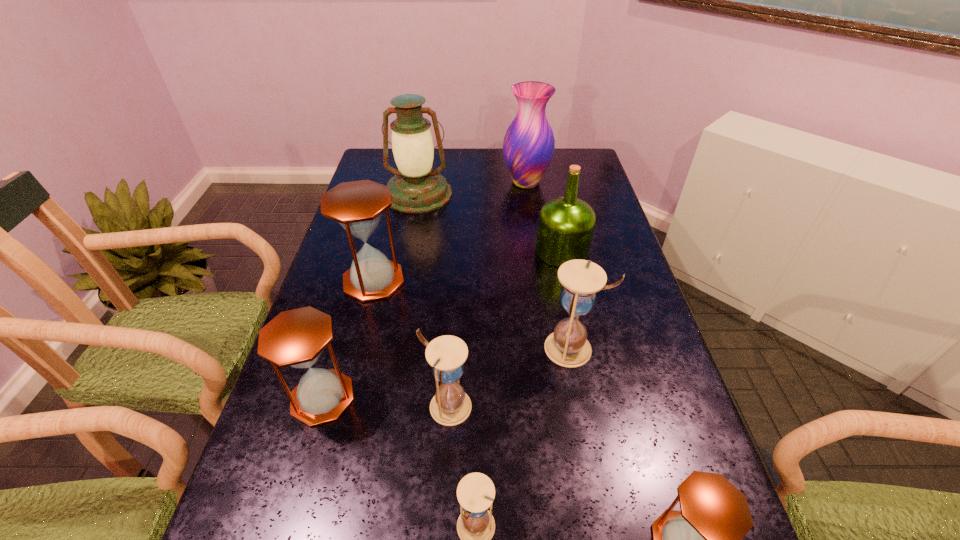
This screenshot has width=960, height=540. What are the coordinates of `vacant space that's between the olive oil and the farthest brown hourglass` in the screenshot? It's located at (468, 266).

The width and height of the screenshot is (960, 540). I want to click on free space between the lantern and the purple vase, so click(x=472, y=188).

What are the coordinates of `free space between the vase and the farthest brown hourglass` in the screenshot? It's located at (450, 232).

This screenshot has width=960, height=540. What are the coordinates of `free space that is in between the olive oil and the biggest brown hourglass` in the screenshot? It's located at pos(468,266).

Identify the location of object that is the sixth nearest to the purple vase. The image size is (960, 540). (296, 338).

Select which object is the fourth closest to the farthest brown hourglass. Please provide its 2D coordinates. Your answer should be formatted as a tuple, i.e. [(x, y)], where the tuple contains the x and y coordinates of a point satisfying the conditions above.

[(566, 224)]

Identify which hourglass is the third nearest to the lantern. Please provide its 2D coordinates. Your answer should be formatted as a tuple, i.e. [(x, y)], where the tuple contains the x and y coordinates of a point satisfying the conditions above.

[(296, 338)]

Point out which hourglass is positioned as the fifth nearest to the second biggest brown hourglass. Please provide its 2D coordinates. Your answer should be formatted as a tuple, i.e. [(x, y)], where the tuple contains the x and y coordinates of a point satisfying the conditions above.

[(704, 539)]

Select which brown hourglass is the closest to the second nearest white hourglass. Please provide its 2D coordinates. Your answer should be formatted as a tuple, i.e. [(x, y)], where the tuple contains the x and y coordinates of a point satisfying the conditions above.

[(296, 338)]

I want to click on brown hourglass that stands as the second closest to the second biggest brown hourglass, so (704, 539).